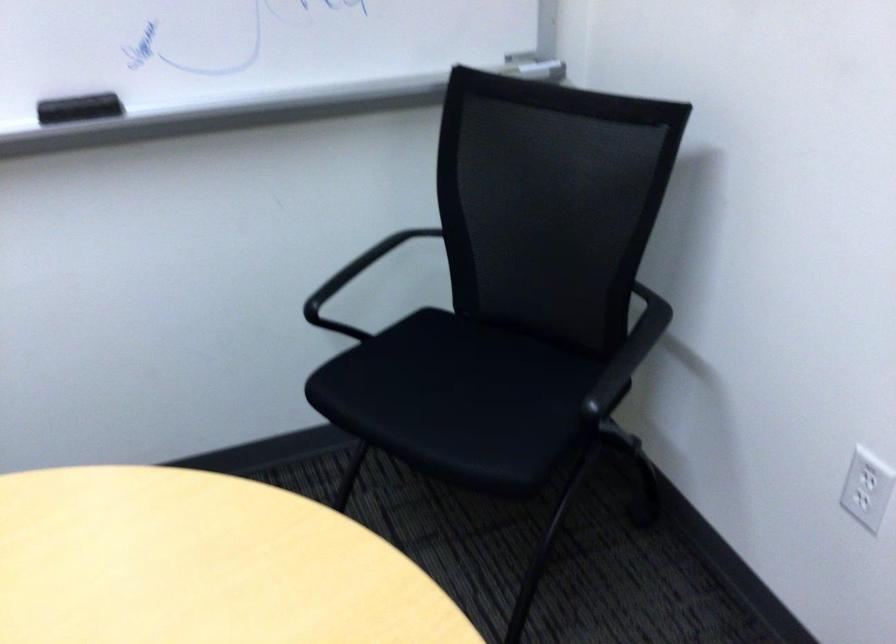
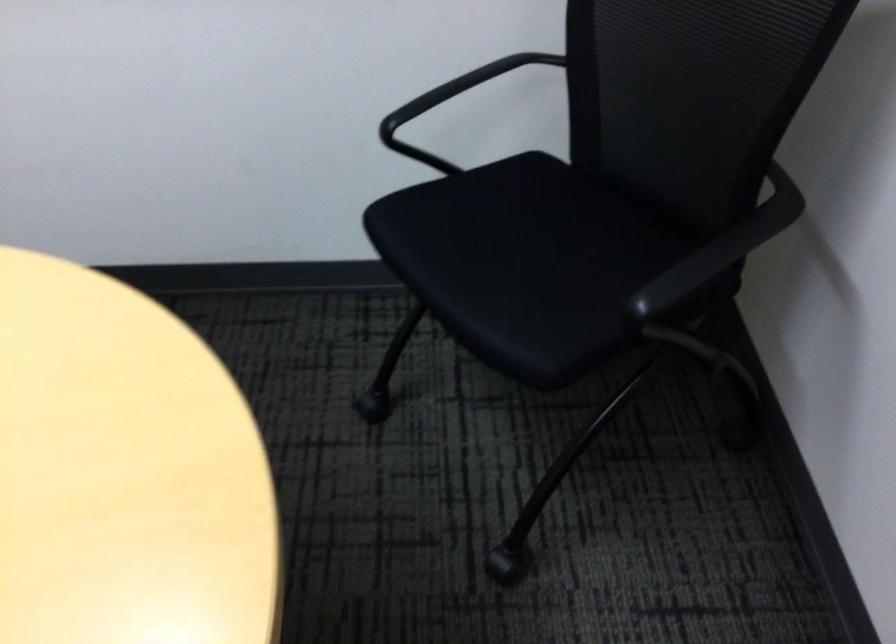
Locate, in the second image, the point that corresponds to point 462,400 in the first image.

(530, 269)